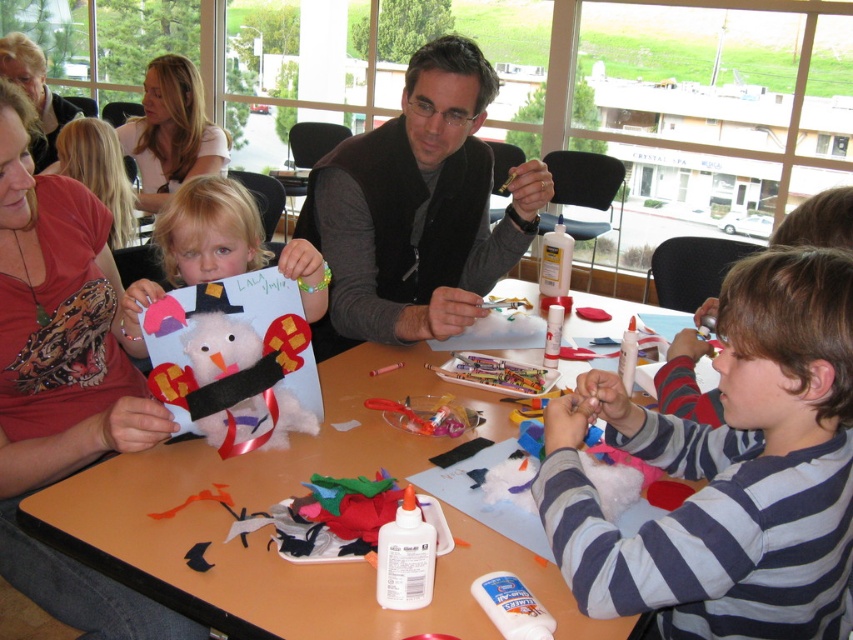
Question: Is fuzzy white snowman at center below matte red shirt at upper left?

Choices:
 (A) yes
 (B) no

Answer: (A)

Question: Does fuzzy white snowman at center come behind light pink fabric shirt at upper left?

Choices:
 (A) no
 (B) yes

Answer: (A)

Question: Estimate the real-world distances between objects in this image. Which object is closer to the fuzzy white snowman at center?

Choices:
 (A) light pink fabric shirt at upper left
 (B) matte white paper at center
 (C) fuzzy felt snowman at center

Answer: (C)

Question: Can you confirm if fuzzy felt snowman at center is positioned below fuzzy white snowman at center?

Choices:
 (A) no
 (B) yes

Answer: (B)

Question: Which object is positioned closest to the black vest at center?

Choices:
 (A) light pink fabric shirt at upper left
 (B) matte red shirt at upper left

Answer: (B)

Question: Based on their relative distances, which object is farther from the fuzzy white snowman at center?

Choices:
 (A) striped cotton shirt at center
 (B) matte red shirt at upper left
 (C) black vest at center
 (D) light pink fabric shirt at upper left

Answer: (D)